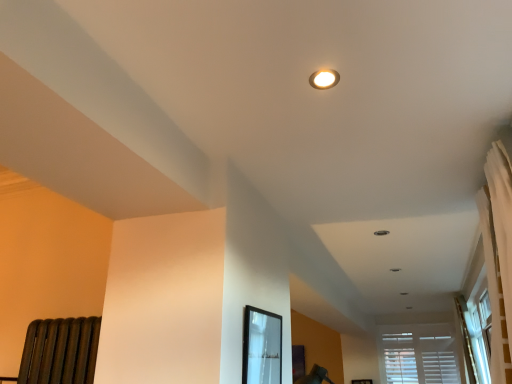
Image resolution: width=512 pixels, height=384 pixels. Identify the location of white wood blinds at lower right. (418, 354).

Where is `matte black frame at center`? matte black frame at center is located at coordinates (262, 347).

Considering the points (324, 88) and (249, 313), which point is behind, point (324, 88) or point (249, 313)?

The point (249, 313) is farther.

From the picture: Does matte white light fixture at upper center touch matte black frame at center?

They are not placed beside each other.

Based on the photo, considering the positions of objects matte white light fixture at upper center and matte black frame at center in the image provided, who is more to the left, matte white light fixture at upper center or matte black frame at center?

From the viewer's perspective, matte black frame at center appears more on the left side.

Is white wood blinds at lower right taller than matte black frame at center?

Indeed, white wood blinds at lower right has a greater height compared to matte black frame at center.

Can you see white wood blinds at lower right touching matte black frame at center?

No, white wood blinds at lower right is not beside matte black frame at center.

From the image's perspective, would you say white wood blinds at lower right is positioned over matte black frame at center?

No.

Would you say white wood blinds at lower right is a long distance from matte white light fixture at upper center?

Yes, white wood blinds at lower right and matte white light fixture at upper center are quite far apart.

How many degrees apart are the facing directions of white wood blinds at lower right and matte white light fixture at upper center?

The angular difference between white wood blinds at lower right and matte white light fixture at upper center is 92.8 degrees.

Where is `lighting that is on the left side of white wood blinds at lower right`? lighting that is on the left side of white wood blinds at lower right is located at coordinates (324, 79).

Is white wood blinds at lower right facing away from matte white light fixture at upper center?

No, matte white light fixture at upper center is not at the back of white wood blinds at lower right.

Can you see matte black frame at center touching matte white light fixture at upper center?

No, matte black frame at center is not next to matte white light fixture at upper center.

From the picture: Considering the sizes of matte black frame at center and matte white light fixture at upper center in the image, is matte black frame at center wider or thinner than matte white light fixture at upper center?

In the image, matte black frame at center appears to be more narrow than matte white light fixture at upper center.

Which point is more forward, (257, 329) or (336, 80)?

The point (336, 80) is more forward.

From the image's perspective, is matte black frame at center located above white wood blinds at lower right?

Yes, from the image's perspective, matte black frame at center is above white wood blinds at lower right.

Which is correct: matte black frame at center is inside white wood blinds at lower right, or outside of it?

matte black frame at center cannot be found inside white wood blinds at lower right.

Which object is closer to the camera taking this photo, matte black frame at center or white wood blinds at lower right?

matte black frame at center is closer to the camera.

From the picture: Is matte white light fixture at upper center inside the boundaries of white wood blinds at lower right, or outside?

matte white light fixture at upper center is not enclosed by white wood blinds at lower right.

Considering the relative positions of matte white light fixture at upper center and white wood blinds at lower right in the image provided, is matte white light fixture at upper center to the right of white wood blinds at lower right from the viewer's perspective?

No.

Which is in front, point (330, 76) or point (426, 352)?

The point (330, 76) is more forward.

Is matte white light fixture at upper center with white wood blinds at lower right?

No, matte white light fixture at upper center is not with white wood blinds at lower right.

You are a GUI agent. You are given a task and a screenshot of the screen. Output one action in this format:
    pyautogui.click(x=<x>, y=<y>)
    Task: Click on the bay window below the matte white light fixture at upper center (from the image's perspective)
    This screenshot has height=384, width=512.
    Given the screenshot: What is the action you would take?
    pyautogui.click(x=262, y=347)

This screenshot has width=512, height=384. I want to click on window lying behind the matte black frame at center, so [418, 354].

Based on their spatial positions, is white wood blinds at lower right or matte black frame at center further from matte white light fixture at upper center?

The object further to matte white light fixture at upper center is white wood blinds at lower right.

Based on their spatial positions, is matte black frame at center or white wood blinds at lower right closer to matte white light fixture at upper center?

matte black frame at center is positioned closer to the anchor matte white light fixture at upper center.

Looking at the image, which one is located closer to white wood blinds at lower right, matte black frame at center or matte white light fixture at upper center?

matte black frame at center lies closer to white wood blinds at lower right than the other object.

When comparing their distances from white wood blinds at lower right, does matte white light fixture at upper center or matte black frame at center seem closer?

The object closer to white wood blinds at lower right is matte black frame at center.

Consider the image. Based on their spatial positions, is matte white light fixture at upper center or white wood blinds at lower right closer to matte black frame at center?

matte white light fixture at upper center lies closer to matte black frame at center than the other object.

Looking at the image, which one is located closer to matte black frame at center, white wood blinds at lower right or matte white light fixture at upper center?

Based on the image, matte white light fixture at upper center appears to be nearer to matte black frame at center.

Identify the location of bay window positioned between matte white light fixture at upper center and white wood blinds at lower right from near to far. (262, 347).